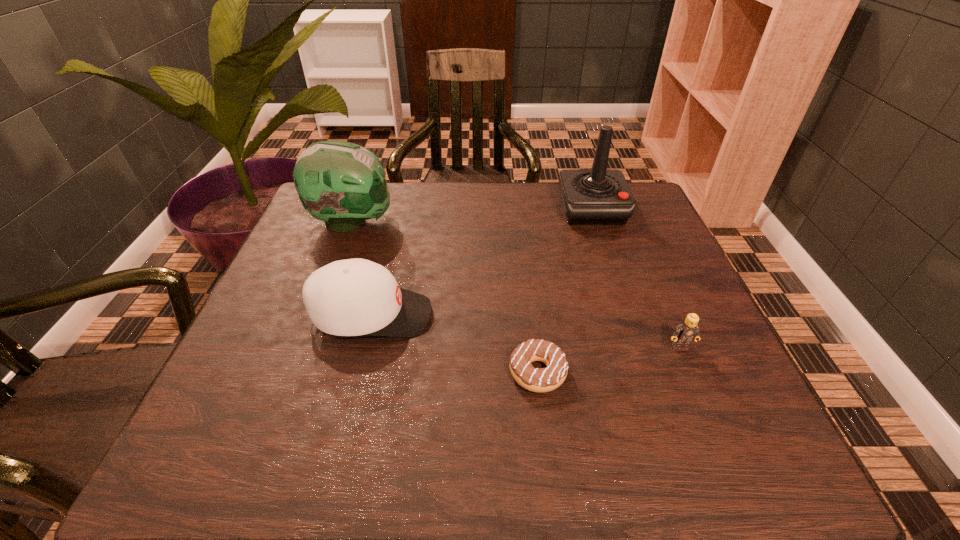
Image resolution: width=960 pixels, height=540 pixels. What are the coordinates of `vacant space located on the left of the shortest object` in the screenshot? It's located at (476, 372).

In order to click on joystick that is at the far edge in this screenshot , I will do (599, 196).

Locate an element on the screen. The image size is (960, 540). football helmet that is at the far edge is located at coordinates (342, 183).

The image size is (960, 540). Find the location of `football helmet positioned at the left edge`. football helmet positioned at the left edge is located at coordinates (342, 183).

You are a GUI agent. You are given a task and a screenshot of the screen. Output one action in this format:
    pyautogui.click(x=<x>, y=<y>)
    Task: Click on the baseball cap that is at the left edge
    Image resolution: width=960 pixels, height=540 pixels.
    Given the screenshot: What is the action you would take?
    pyautogui.click(x=352, y=297)

Where is `joystick that is at the right edge`? The image size is (960, 540). joystick that is at the right edge is located at coordinates (599, 196).

Identify the location of Lego at the right edge. Image resolution: width=960 pixels, height=540 pixels. (685, 333).

Locate an element on the screen. object at the far left corner is located at coordinates (342, 183).

Find the location of a particular element. The image size is (960, 540). object situated at the far right corner is located at coordinates (599, 196).

Find the location of a particular element. vacant region at the far edge of the desktop is located at coordinates (535, 192).